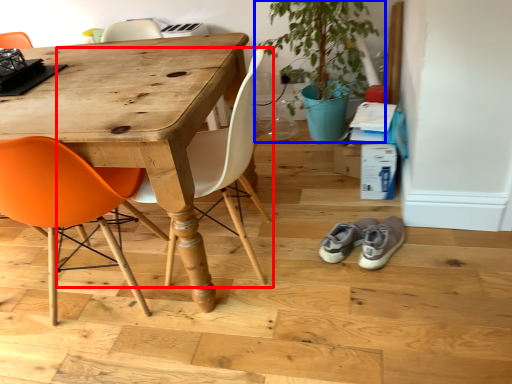
Question: Which object is further to the camera taking this photo, chair (highlighted by a red box) or houseplant (highlighted by a blue box)?

Choices:
 (A) chair
 (B) houseplant

Answer: (B)